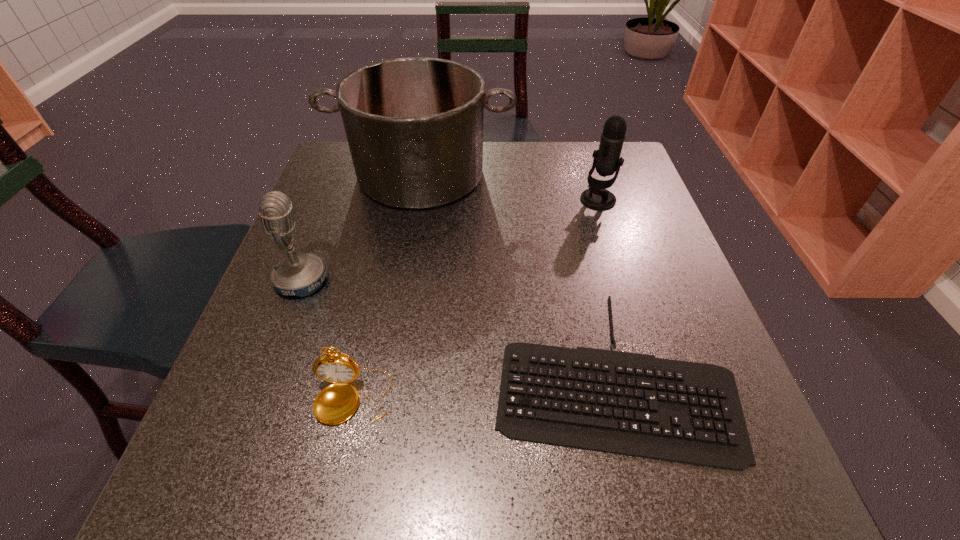
Find the location of `object located at the near right corner`. object located at the near right corner is located at coordinates (634, 404).

Where is `free spot at the far edge of the desktop`? free spot at the far edge of the desktop is located at coordinates (545, 171).

In the image, there is a desktop. At what (x,y) coordinates should I click in order to perform the action: click on free space at the near edge. Please return your answer as a coordinate pair (x, y). This screenshot has width=960, height=540. Looking at the image, I should click on (339, 499).

You are a GUI agent. You are given a task and a screenshot of the screen. Output one action in this format:
    pyautogui.click(x=<x>, y=<y>)
    Task: Click on the free space at the left edge of the desktop
    This screenshot has height=540, width=960.
    Given the screenshot: What is the action you would take?
    pyautogui.click(x=330, y=228)

The width and height of the screenshot is (960, 540). In the image, there is a desktop. Identify the location of free region at the right edge. (669, 305).

Locate an element on the screen. vacant region at the far left corner of the desktop is located at coordinates (343, 167).

The image size is (960, 540). I want to click on free space between the left microphone and the right microphone, so click(450, 240).

Locate an element on the screen. This screenshot has width=960, height=540. vacant space that is in between the farther microphone and the left microphone is located at coordinates (450, 240).

You are a GUI agent. You are given a task and a screenshot of the screen. Output one action in this format:
    pyautogui.click(x=<x>, y=<y>)
    Task: Click on the empty space that is in between the farther microphone and the computer keyboard
    
    Given the screenshot: What is the action you would take?
    pyautogui.click(x=604, y=285)

Find the location of a particular element. Image resolution: width=960 pixels, height=540 pixels. free space between the second shortest object and the farther microphone is located at coordinates tap(476, 299).